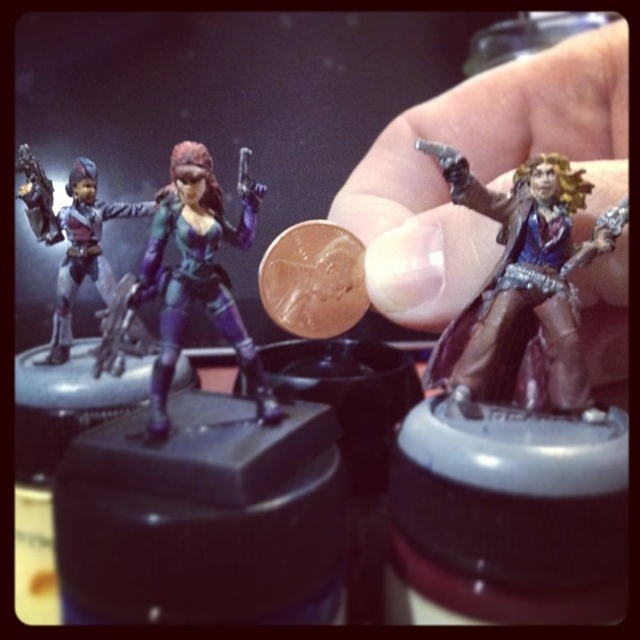
Question: Which point is farther from the camera taking this photo?

Choices:
 (A) (584, 256)
 (B) (74, 196)

Answer: (B)

Question: Which point is closer to the camera taking this photo?

Choices:
 (A) (202, 145)
 (B) (552, 212)
 (C) (84, 160)
 (D) (310, 243)

Answer: (A)

Question: Is shiny brown coat at center right above matte black figure at center?

Choices:
 (A) no
 (B) yes

Answer: (A)

Question: Which of the following is the farthest from the observer?

Choices:
 (A) matte purple figure at center
 (B) brown leather glove at upper center

Answer: (B)

Question: Can you confirm if shiny brown coat at center right is wider than matte black figure at center?

Choices:
 (A) no
 (B) yes

Answer: (B)

Question: Is brown leather glove at upper center to the left of shiny brown coat at center right from the viewer's perspective?

Choices:
 (A) no
 (B) yes

Answer: (A)